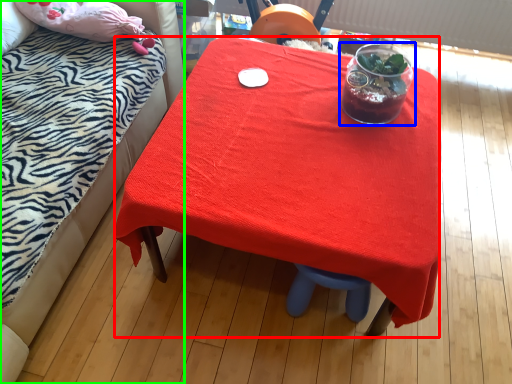
Question: Considering the real-world distances, which object is closest to desk (highlighted by a red box)? tableware (highlighted by a blue box) or bed (highlighted by a green box).

Choices:
 (A) tableware
 (B) bed

Answer: (A)